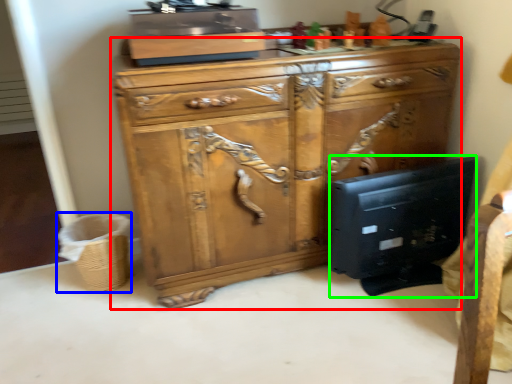
Question: Which object is the farthest from chest of drawers (highlighted by a red box)? Choose among these: basket (highlighted by a blue box) or desktop computer (highlighted by a green box).

Choices:
 (A) basket
 (B) desktop computer

Answer: (A)